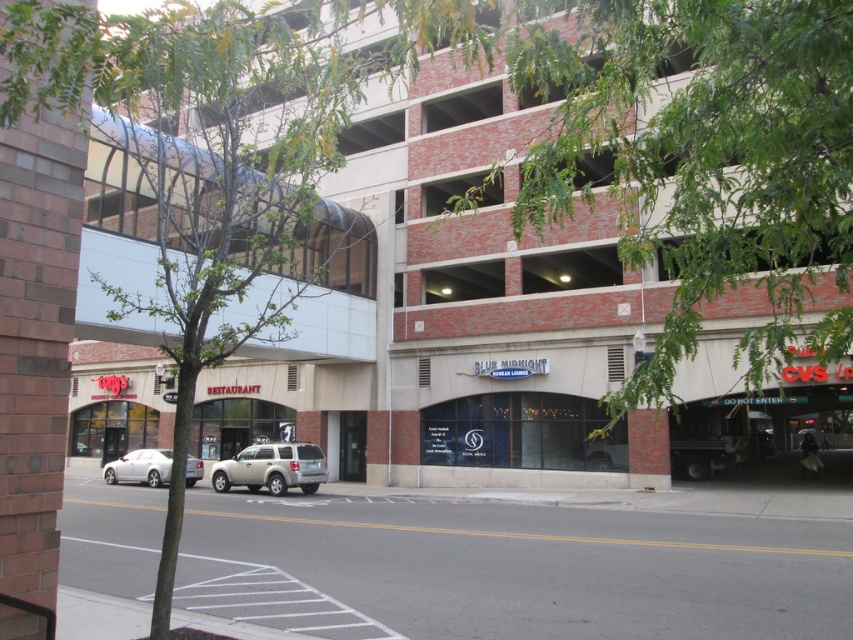
Does point (744, 228) come in front of point (125, 481)?

Yes, it is in front of point (125, 481).

Can you confirm if brick wall parking garage at center is positioned to the left of silver metallic sedan at lower left?

No, brick wall parking garage at center is not to the left of silver metallic sedan at lower left.

Is point (483, 444) less distant than point (143, 460)?

Yes, point (483, 444) is closer to viewer.

The width and height of the screenshot is (853, 640). Find the location of `brick wall parking garage at center`. brick wall parking garage at center is located at coordinates (608, 225).

Does brick wall parking garage at center have a lesser width compared to satin silver suv at center?

In fact, brick wall parking garage at center might be wider than satin silver suv at center.

Which is above, brick wall parking garage at center or satin silver suv at center?

brick wall parking garage at center is above.

You are a GUI agent. You are given a task and a screenshot of the screen. Output one action in this format:
    pyautogui.click(x=<x>, y=<y>)
    Task: Click on the brick wall parking garage at center
    This screenshot has height=640, width=853.
    Given the screenshot: What is the action you would take?
    [x=608, y=225]

Identify the location of brick wall parking garage at center. This screenshot has width=853, height=640. (608, 225).

Can you confirm if green leafy tree at upper center is bigger than satin silver suv at center?

Correct, green leafy tree at upper center is larger in size than satin silver suv at center.

Does point (782, 339) lie in front of point (241, 477)?

That is True.

What do you see at coordinates (700, 157) in the screenshot? I see `green leafy tree at upper center` at bounding box center [700, 157].

This screenshot has height=640, width=853. I want to click on green leafy tree at upper center, so click(x=700, y=157).